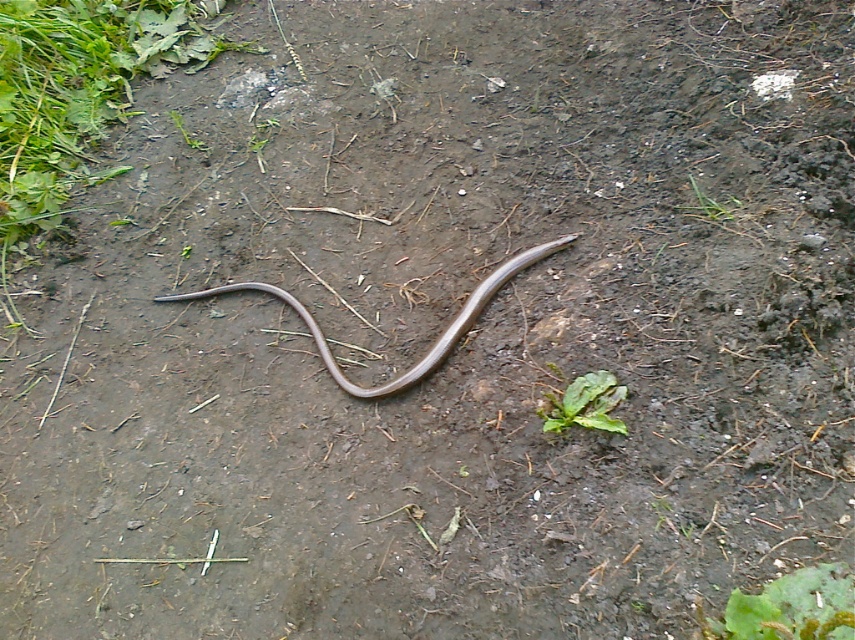
How distant is brown matte snake at center from green leafy plant at center?

brown matte snake at center and green leafy plant at center are 41.65 centimeters apart.

Is brown matte snake at center to the right of green leafy plant at center from the viewer's perspective?

In fact, brown matte snake at center is to the left of green leafy plant at center.

Where is `brown matte snake at center`? The height and width of the screenshot is (640, 855). brown matte snake at center is located at coordinates (431, 346).